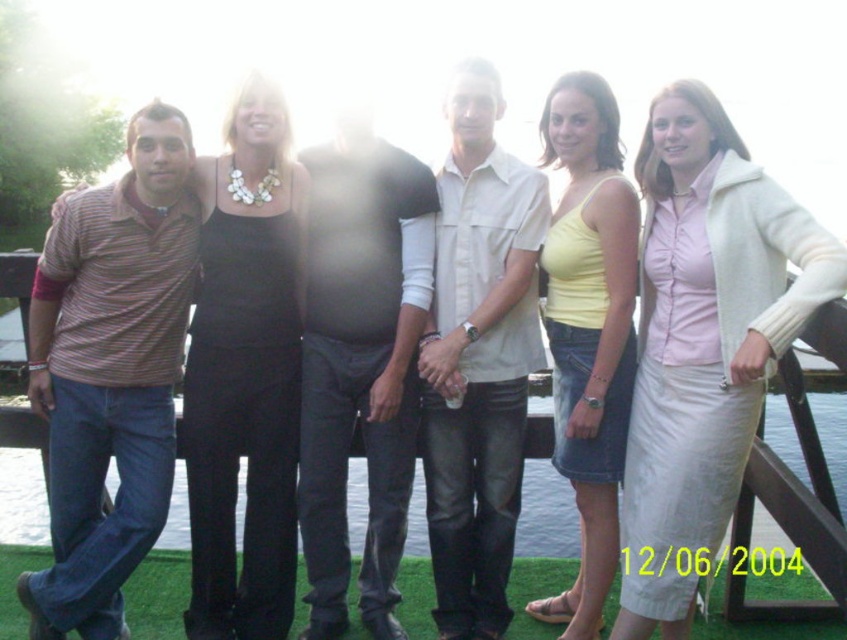
Question: Considering the real-world distances, which object is farthest from the white matte shirt at center?

Choices:
 (A) dark gray jeans at center
 (B) matte yellow tank top at center

Answer: (A)

Question: Observing the image, what is the correct spatial positioning of white matte shirt at center in reference to matte yellow tank top at center?

Choices:
 (A) right
 (B) left

Answer: (B)

Question: Among these objects, which one is nearest to the camera?

Choices:
 (A) dark gray jeans at center
 (B) white satin skirt at center
 (C) white matte shirt at center
 (D) striped cotton shirt at left

Answer: (B)

Question: Based on their relative distances, which object is farther from the clear water at lower left?

Choices:
 (A) black satin dress at center
 (B) dark gray jeans at center

Answer: (B)

Question: Can you confirm if white matte shirt at center is positioned to the left of matte yellow tank top at center?

Choices:
 (A) yes
 (B) no

Answer: (A)

Question: Is striped cotton shirt at left closer to the viewer compared to white matte shirt at center?

Choices:
 (A) no
 (B) yes

Answer: (B)